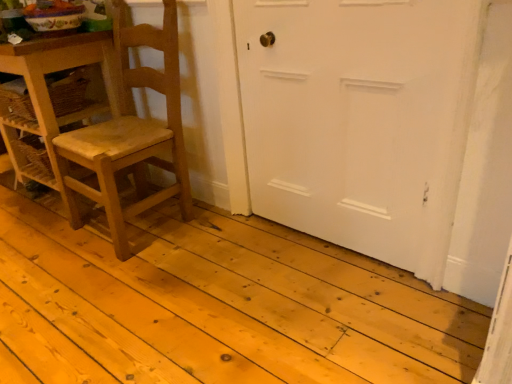
Identify the location of vacant area in front of wooden chair at left. Image resolution: width=512 pixels, height=384 pixels. (114, 281).